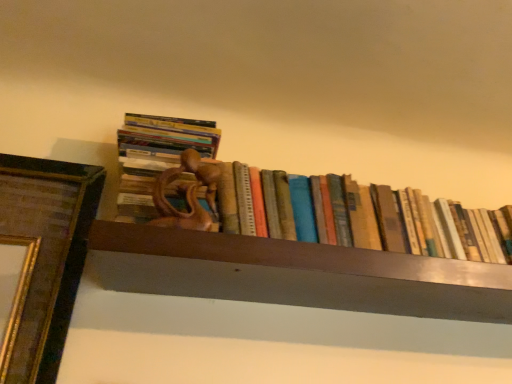
Question: Which is correct: old paper book at center, the first book in the right-to-left sequence, is inside wooden statue at center, which is the 1th book from left to right, or outside of it?

Choices:
 (A) outside
 (B) inside

Answer: (A)

Question: Is old paper book at center, which is the second book in left-to-right order, wider or thinner than wooden statue at center, acting as the second book starting from the right?

Choices:
 (A) thin
 (B) wide

Answer: (A)

Question: From their relative heights in the image, would you say old paper book at center, the first book in the right-to-left sequence, is taller or shorter than wooden statue at center, which is the 1th book from left to right?

Choices:
 (A) tall
 (B) short

Answer: (B)

Question: From their relative heights in the image, would you say wooden statue at center, which is the 1th book from left to right, is taller or shorter than old paper book at center, which is the second book in left-to-right order?

Choices:
 (A) tall
 (B) short

Answer: (A)

Question: From a real-world perspective, is wooden statue at center, which is the 1th book from left to right, physically located above or below old paper book at center, which is the second book in left-to-right order?

Choices:
 (A) above
 (B) below

Answer: (A)

Question: Considering their positions, is wooden statue at center, acting as the second book starting from the right, located in front of or behind old paper book at center, which is the second book in left-to-right order?

Choices:
 (A) behind
 (B) front

Answer: (B)

Question: Would you say wooden statue at center, acting as the second book starting from the right, is inside or outside old paper book at center, which is the second book in left-to-right order?

Choices:
 (A) outside
 (B) inside

Answer: (A)